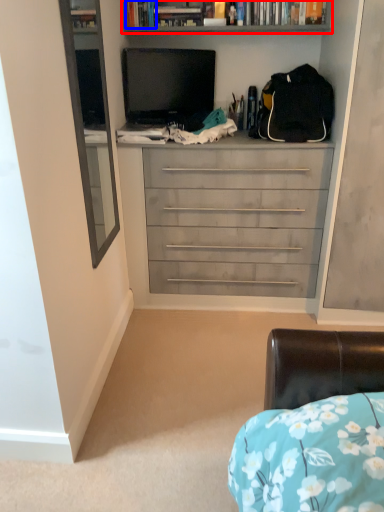
Question: Which object is further to the camera taking this photo, bookcase (highlighted by a red box) or book (highlighted by a blue box)?

Choices:
 (A) bookcase
 (B) book

Answer: (B)